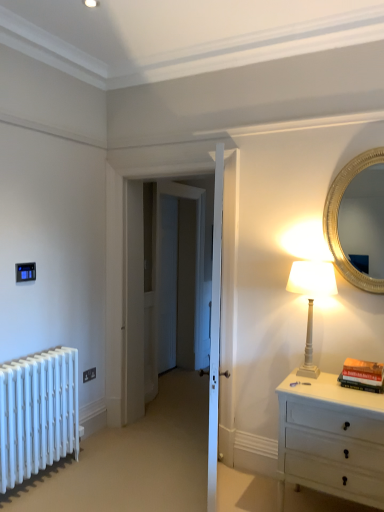
I want to click on free space in front of white glossy table lamp at right, so click(x=334, y=387).